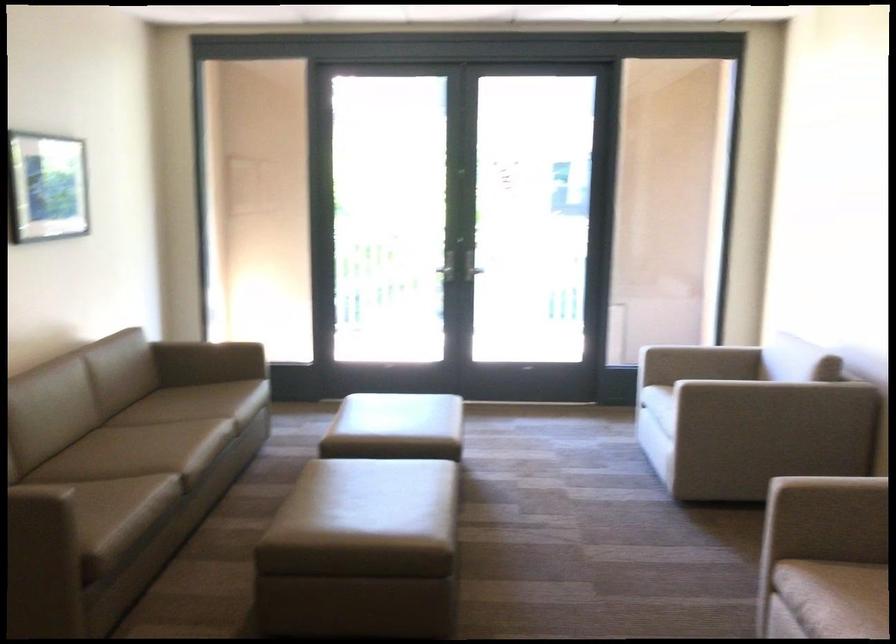
Find the location of a particular element. brown sofa sitting surface is located at coordinates (122, 399).